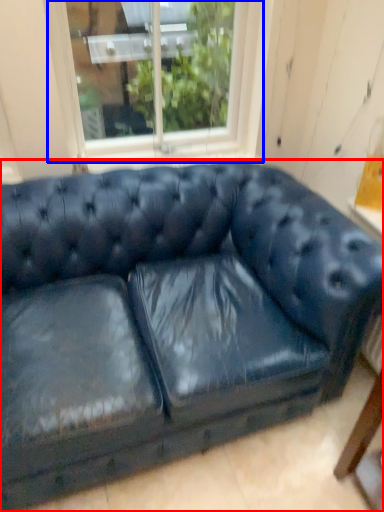
Question: Which object is closer to the camera taking this photo, studio couch (highlighted by a red box) or window (highlighted by a blue box)?

Choices:
 (A) studio couch
 (B) window

Answer: (A)